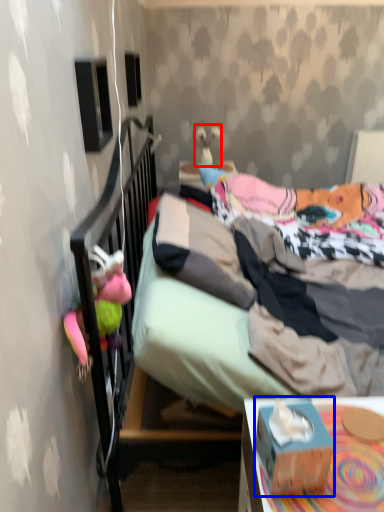
Question: Among these objects, which one is nearest to the camera, toy (highlighted by a red box) or box (highlighted by a blue box)?

Choices:
 (A) toy
 (B) box

Answer: (B)